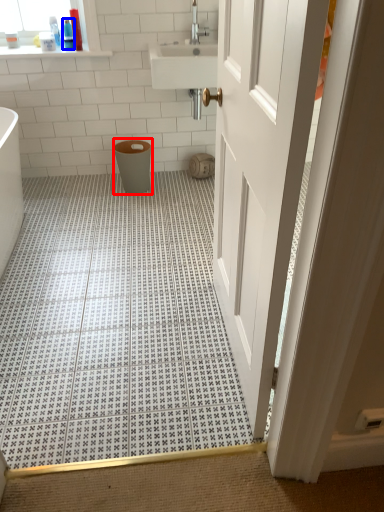
Question: Which object appears closest to the camera in this image, toilet bowl (highlighted by a red box) or toiletry (highlighted by a blue box)?

Choices:
 (A) toilet bowl
 (B) toiletry

Answer: (A)